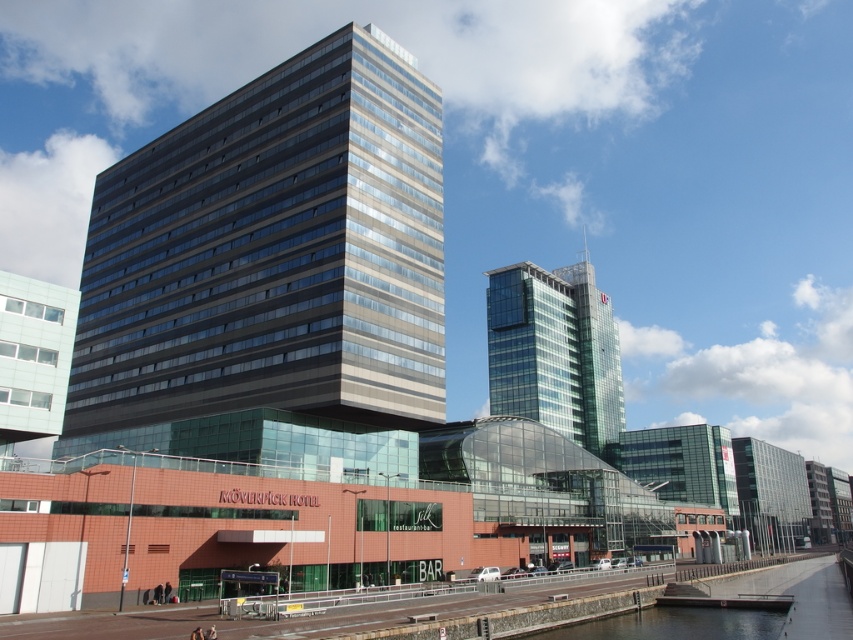
Is point (560, 342) positioned behind point (726, 609)?

Yes, it is.

Can you confirm if clear glass skyscraper at center is bigger than smooth concrete river at lower center?

Indeed, clear glass skyscraper at center has a larger size compared to smooth concrete river at lower center.

What do you see at coordinates (534, 348) in the screenshot?
I see `clear glass skyscraper at center` at bounding box center [534, 348].

Where is `clear glass skyscraper at center`? Image resolution: width=853 pixels, height=640 pixels. clear glass skyscraper at center is located at coordinates (534, 348).

Does glassy metallic building at center come in front of clear glass skyscraper at center?

Yes, it is in front of clear glass skyscraper at center.

Does glassy metallic building at center appear over clear glass skyscraper at center?

Yes, glassy metallic building at center is above clear glass skyscraper at center.

Which is behind, point (91, 336) or point (514, 332)?

The point (514, 332) is more distant.

Image resolution: width=853 pixels, height=640 pixels. I want to click on glassy metallic building at center, so click(273, 275).

Who is positioned more to the right, glassy metallic building at center or smooth concrete river at lower center?

smooth concrete river at lower center is more to the right.

Which is below, glassy metallic building at center or smooth concrete river at lower center?

smooth concrete river at lower center

What do you see at coordinates (273, 275) in the screenshot? I see `glassy metallic building at center` at bounding box center [273, 275].

Locate an element on the screen. The image size is (853, 640). glassy metallic building at center is located at coordinates (273, 275).